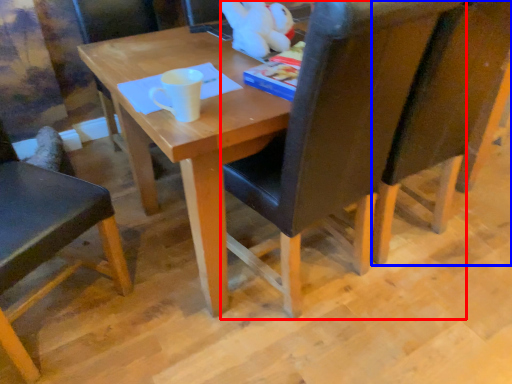
Question: Which point is closer to the camera, chair (highlighted by a red box) or chair (highlighted by a blue box)?

Choices:
 (A) chair
 (B) chair

Answer: (A)